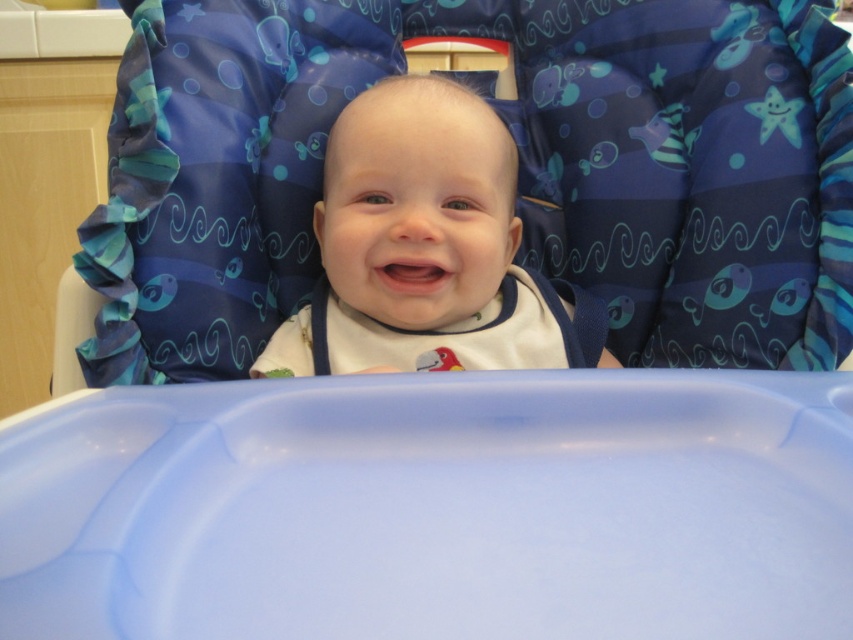
Question: Which point is closer to the camera?

Choices:
 (A) (556, 52)
 (B) (419, 205)

Answer: (B)

Question: In this image, where is white soft baby at center located relative to white fabric bib at center?

Choices:
 (A) right
 (B) left

Answer: (B)

Question: From the image, what is the correct spatial relationship of blue fabric feeding chair at upper center in relation to white soft baby at center?

Choices:
 (A) below
 (B) above

Answer: (B)

Question: Which object is positioned farthest from the white soft baby at center?

Choices:
 (A) white fabric bib at center
 (B) blue fabric feeding chair at upper center

Answer: (B)

Question: Which point appears farthest from the camera in this image?

Choices:
 (A) (480, 131)
 (B) (328, 362)
 (C) (746, 38)

Answer: (C)

Question: Can you confirm if blue fabric feeding chair at upper center is wider than white fabric bib at center?

Choices:
 (A) no
 (B) yes

Answer: (B)